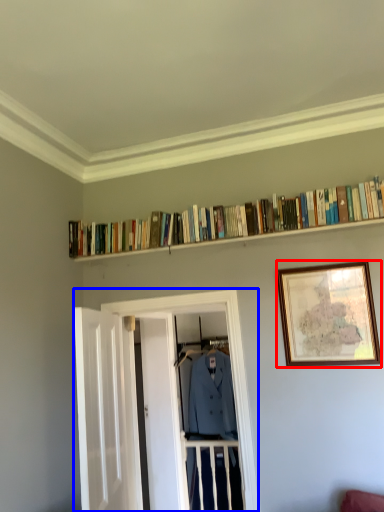
Question: Which object is closer to the camera taking this photo, picture frame (highlighted by a red box) or glass door (highlighted by a blue box)?

Choices:
 (A) picture frame
 (B) glass door

Answer: (A)